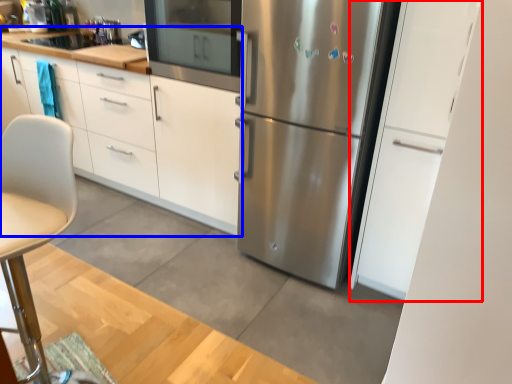
Question: Which object appears closest to the camera in this image, cabinetry (highlighted by a red box) or cabinetry (highlighted by a blue box)?

Choices:
 (A) cabinetry
 (B) cabinetry

Answer: (A)